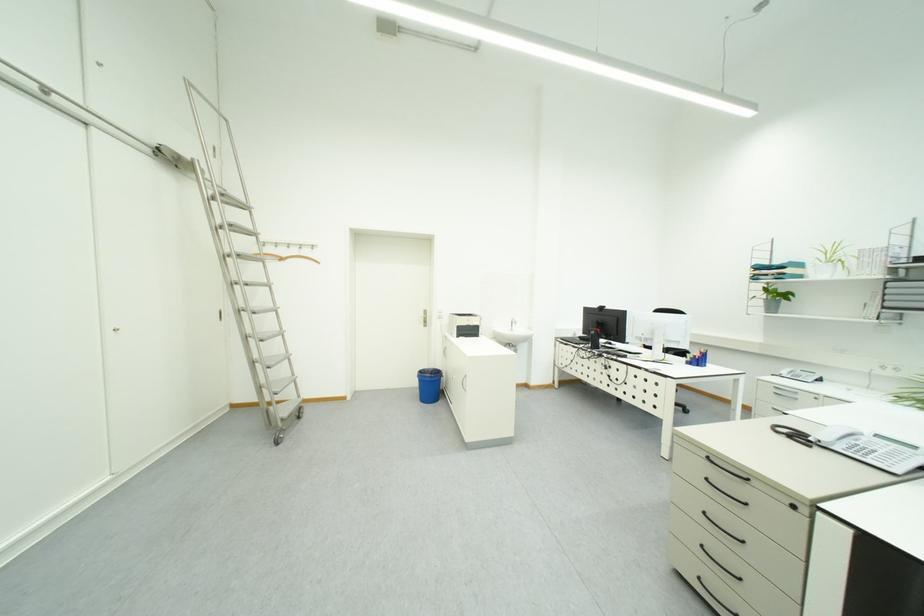
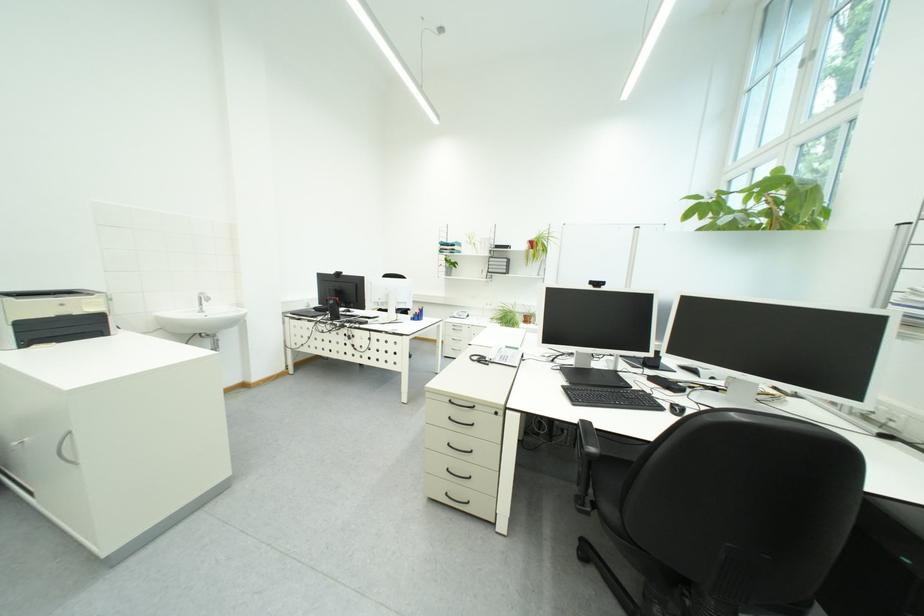
Locate, in the second image, the point that corresponds to pixel 809 439 in the first image.

(492, 362)